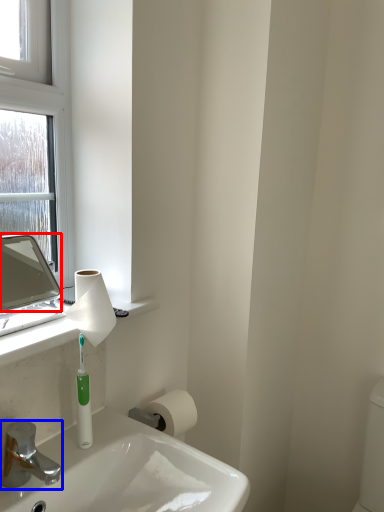
Question: Which object is closer to the camera taking this photo, mirror (highlighted by a red box) or tap (highlighted by a blue box)?

Choices:
 (A) mirror
 (B) tap

Answer: (B)